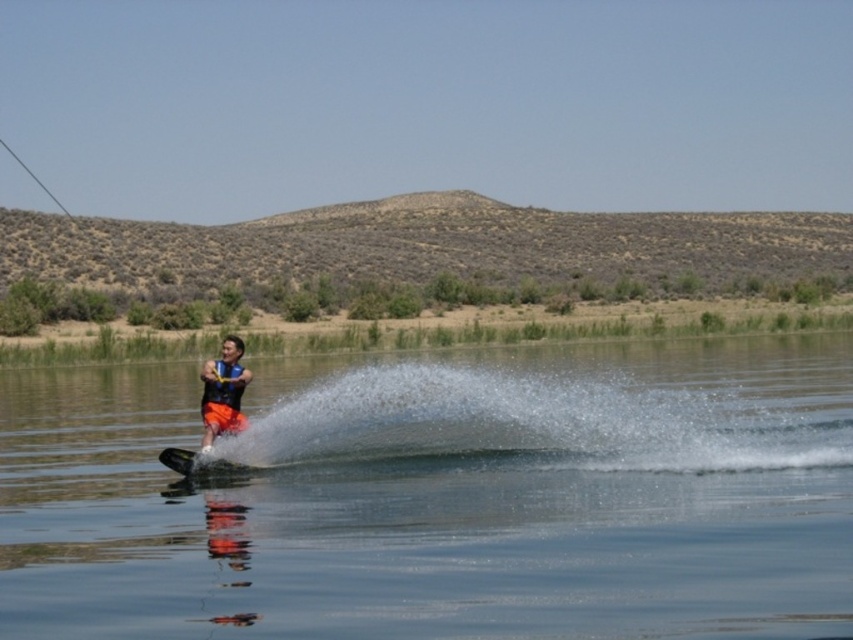
Between orange life vest at center and black matte water ski at lower center, which one is positioned lower?

Positioned lower is black matte water ski at lower center.

The width and height of the screenshot is (853, 640). What are the coordinates of `orange life vest at center` in the screenshot? It's located at (223, 392).

Between clear water at center and orange life vest at center, which one appears on the right side from the viewer's perspective?

Positioned to the right is clear water at center.

Is clear water at center in front of orange life vest at center?

Yes, it is in front of orange life vest at center.

Is point (724, 628) farther from camera compared to point (213, 426)?

No, it is in front of (213, 426).

Locate an element on the screen. Image resolution: width=853 pixels, height=640 pixels. clear water at center is located at coordinates (442, 497).

Who is shorter, clear water at center or black matte water ski at lower center?

With less height is black matte water ski at lower center.

At what (x,y) coordinates should I click in order to perform the action: click on clear water at center. Please return your answer as a coordinate pair (x, y). Looking at the image, I should click on (442, 497).